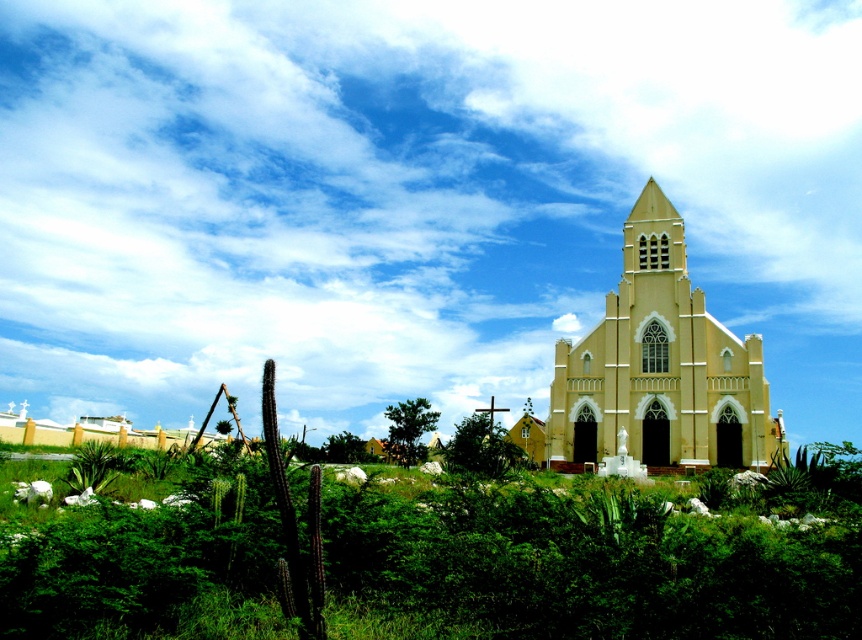
Who is taller, green leafy shrubs at center or green leafy bush at center?

Standing taller between the two is green leafy shrubs at center.

Find the location of `green leafy shrubs at center`. green leafy shrubs at center is located at coordinates (428, 561).

This screenshot has width=862, height=640. Describe the element at coordinates (411, 196) in the screenshot. I see `white fluffy cloud at upper center` at that location.

Who is more distant from viewer, (506, 195) or (561, 339)?

Positioned behind is point (506, 195).

The width and height of the screenshot is (862, 640). Identify the location of white fluffy cloud at upper center. (411, 196).

Which of these two, green leafy shrubs at center or yellow matte church at center, stands taller?

yellow matte church at center is taller.

Between point (734, 616) and point (753, 417), which one is positioned behind?

Point (753, 417)

Does point (836, 625) come in front of point (642, 332)?

Yes, it is.

You are a GUI agent. You are given a task and a screenshot of the screen. Output one action in this format:
    pyautogui.click(x=<x>, y=<y>)
    Task: Click on the green leafy shrubs at center
    The height and width of the screenshot is (640, 862).
    Given the screenshot: What is the action you would take?
    pyautogui.click(x=428, y=561)